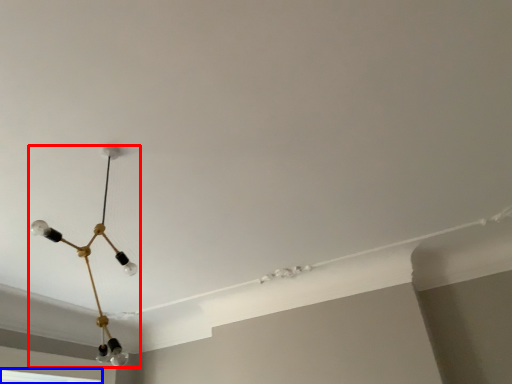
Question: Which point is closer to the camera, lamp (highlighted by a red box) or window (highlighted by a blue box)?

Choices:
 (A) lamp
 (B) window

Answer: (A)